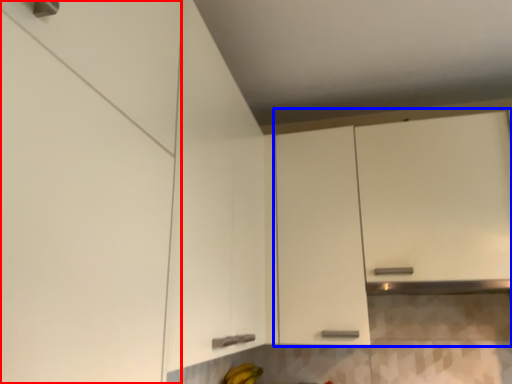
Question: Which object is closer to the camera taking this photo, cabinetry (highlighted by a red box) or cabinetry (highlighted by a blue box)?

Choices:
 (A) cabinetry
 (B) cabinetry

Answer: (A)